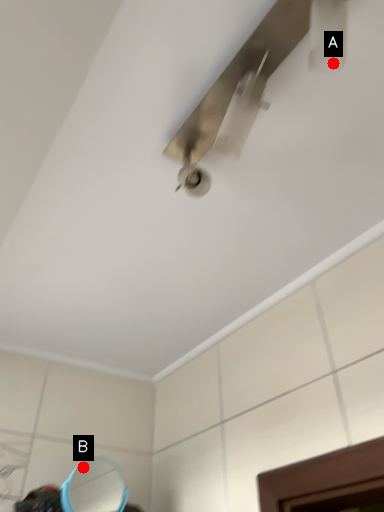
Question: Two points are circled on the image, labeled by A and B beside each circle. Which of the following is the closest to the observer?

Choices:
 (A) A is closer
 (B) B is closer

Answer: (A)